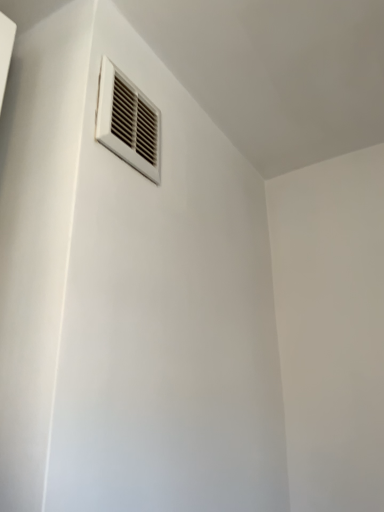
The height and width of the screenshot is (512, 384). I want to click on white plastic vent at upper center, so click(127, 122).

Describe the element at coordinates (127, 122) in the screenshot. This screenshot has width=384, height=512. I see `white plastic vent at upper center` at that location.

Where is `white plastic vent at upper center`? This screenshot has height=512, width=384. white plastic vent at upper center is located at coordinates (127, 122).